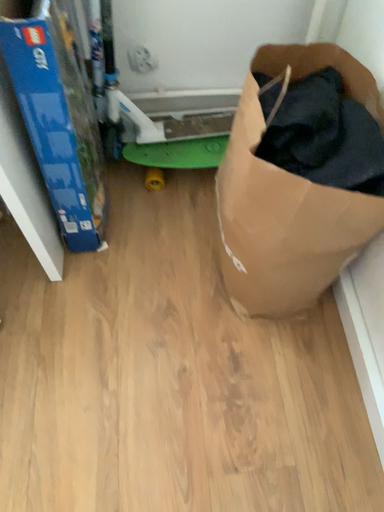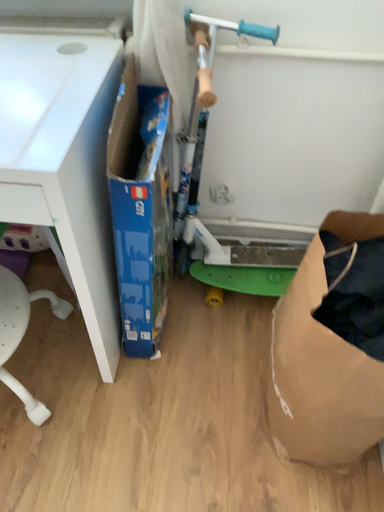
Question: Which way did the camera rotate in the video?

Choices:
 (A) rotated downward
 (B) rotated upward

Answer: (B)